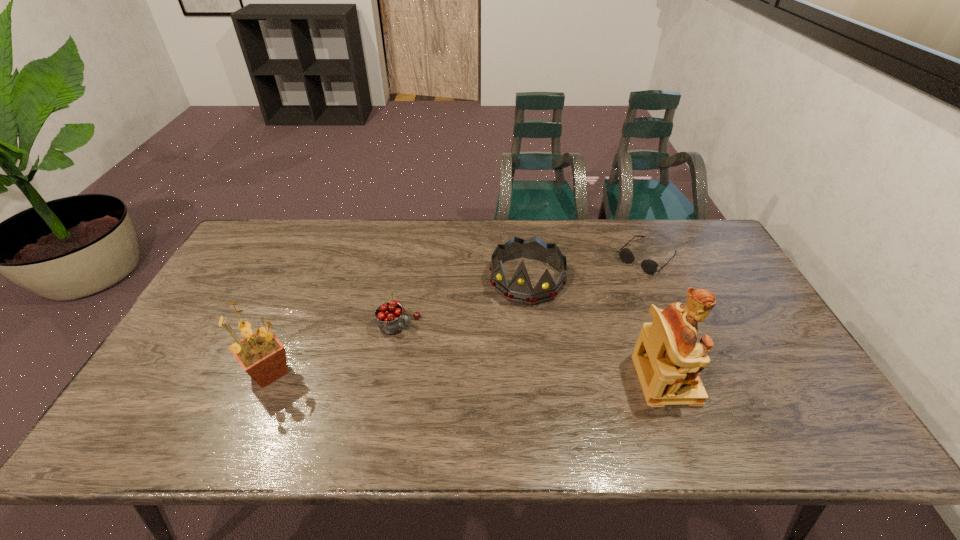
Find the location of a particular element. The image size is (960, 540). sunflower is located at coordinates (263, 357).

At what (x,y) coordinates should I click in order to perform the action: click on the second tallest object. Please return your answer as a coordinate pair (x, y). The image size is (960, 540). Looking at the image, I should click on (263, 357).

Identify the location of figurine. (668, 359).

Identify the location of the shortest object. The height and width of the screenshot is (540, 960). (649, 266).

You are a GUI agent. You are given a task and a screenshot of the screen. Output one action in this format:
    pyautogui.click(x=<x>, y=<y>)
    Task: Click on the third object from left to right
    The image size is (960, 540).
    Given the screenshot: What is the action you would take?
    pyautogui.click(x=520, y=289)

You are a GUI agent. You are given a task and a screenshot of the screen. Output one action in this format:
    pyautogui.click(x=<x>, y=<y>)
    Task: Click on the tiara
    The image size is (960, 540).
    Given the screenshot: What is the action you would take?
    pyautogui.click(x=520, y=289)

Find the location of a particular element. pot filled with cherries is located at coordinates (390, 319).

Image resolution: width=960 pixels, height=540 pixels. I want to click on the second object from left to right, so click(x=390, y=319).

Locate an element on the screen. The width and height of the screenshot is (960, 540). free space located 0.100m on the front-facing side of the figurine is located at coordinates coord(732,379).

This screenshot has height=540, width=960. Identify the location of vacant area located 0.360m on the front-facing side of the shortest object. coord(564,336).